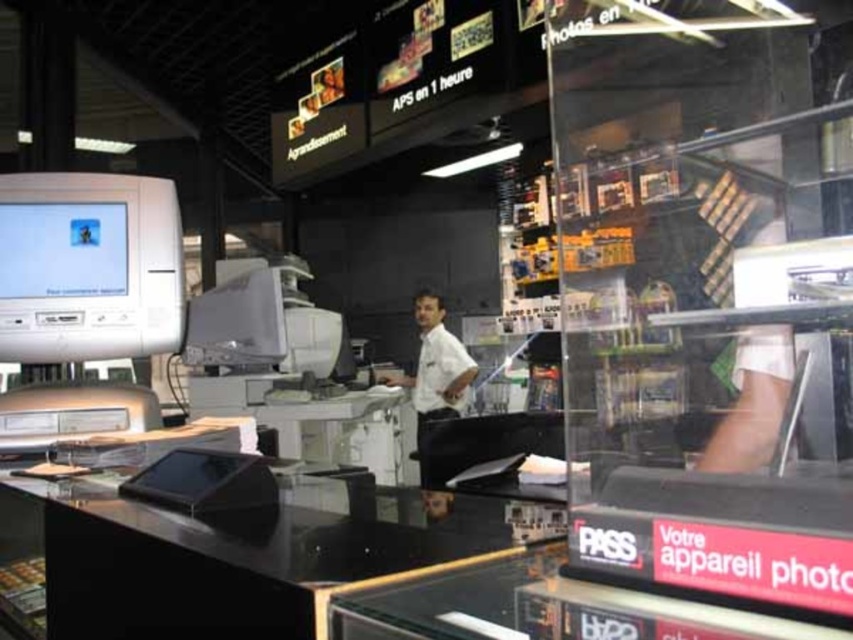
Between point (212, 289) and point (426, 314), which one is positioned behind?

The point (426, 314) is behind.

Who is more distant from viewer, (x=277, y=333) or (x=416, y=440)?

Positioned behind is point (x=416, y=440).

This screenshot has height=640, width=853. Find the location of `satin silver monitor at center`. satin silver monitor at center is located at coordinates (236, 321).

From the picture: Is matte white monitor at left in front of satin silver monitor at center?

That is True.

Can you confirm if matte white monitor at left is wider than satin silver monitor at center?

Correct, the width of matte white monitor at left exceeds that of satin silver monitor at center.

Is point (107, 288) positioned in front of point (253, 276)?

Yes, point (107, 288) is in front of point (253, 276).

Where is `matte white monitor at left`? Image resolution: width=853 pixels, height=640 pixels. matte white monitor at left is located at coordinates (88, 266).

From the picture: Is matte white monitor at left bigger than matte white monitor at upper left?

Indeed, matte white monitor at left has a larger size compared to matte white monitor at upper left.

Which is more to the right, matte white monitor at left or matte white monitor at upper left?

From the viewer's perspective, matte white monitor at left appears more on the right side.

Locate an element on the screen. matte white monitor at left is located at coordinates (88, 266).

In order to click on matte white monitor at left in this screenshot , I will do `click(88, 266)`.